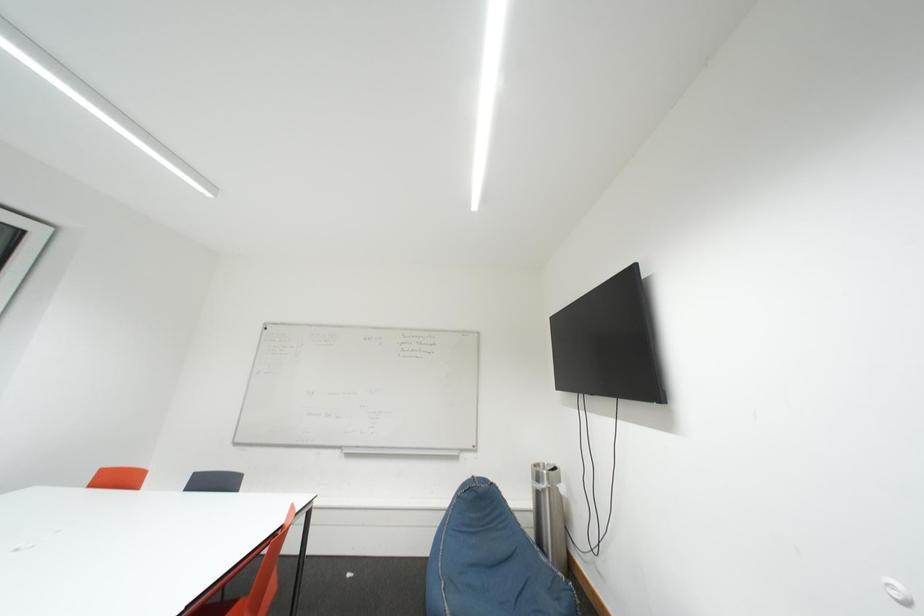
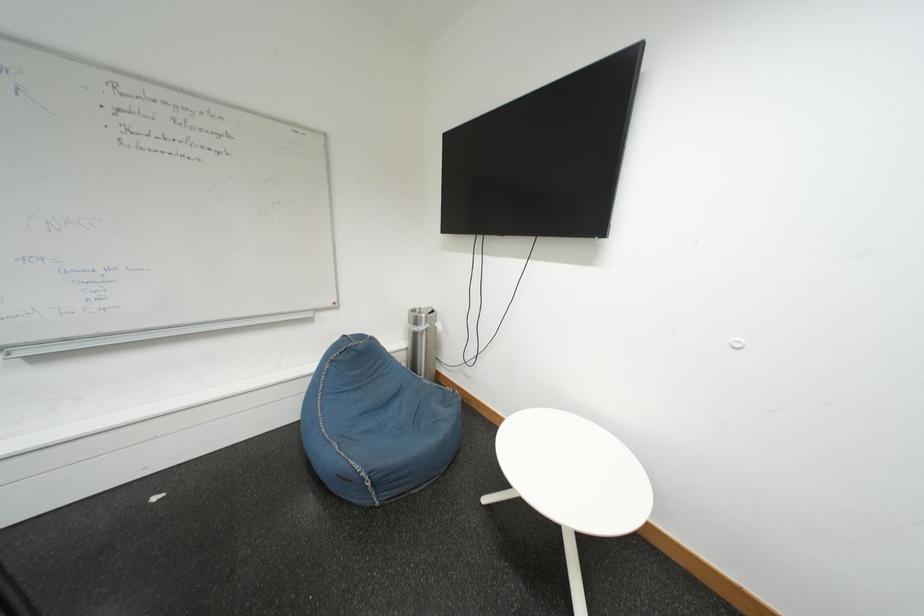
The first image is from the beginning of the video and the second image is from the end. How did the camera likely rotate when shooting the video?

The camera rotated toward right-down.